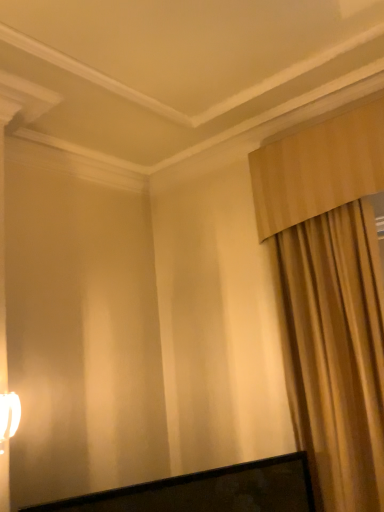
The image size is (384, 512). Describe the element at coordinates (330, 296) in the screenshot. I see `beige fabric curtain at right` at that location.

At what (x,y) coordinates should I click in order to perform the action: click on beige fabric curtain at right. Please return your answer as a coordinate pair (x, y). This screenshot has height=512, width=384. Looking at the image, I should click on (330, 296).

At what (x,y) coordinates should I click in order to perform the action: click on white glossy table lamp at left. Please return your answer as a coordinate pair (x, y). The height and width of the screenshot is (512, 384). Looking at the image, I should click on (9, 417).

Describe the element at coordinates (9, 417) in the screenshot. Image resolution: width=384 pixels, height=512 pixels. I see `white glossy table lamp at left` at that location.

Where is `beige fabric curtain at right`? The height and width of the screenshot is (512, 384). beige fabric curtain at right is located at coordinates (330, 296).

Which is more to the left, white glossy table lamp at left or beige fabric curtain at right?

white glossy table lamp at left is more to the left.

Which object is more forward, white glossy table lamp at left or beige fabric curtain at right?

white glossy table lamp at left is closer to the camera.

Which is closer to the camera, (x=19, y=400) or (x=295, y=219)?

Clearly, point (x=19, y=400) is closer to the camera than point (x=295, y=219).

From the image's perspective, would you say white glossy table lamp at left is positioned over beige fabric curtain at right?

No, from the image's perspective, white glossy table lamp at left is not above beige fabric curtain at right.

From a real-world perspective, which is physically below, white glossy table lamp at left or beige fabric curtain at right?

From a 3D spatial view, white glossy table lamp at left is below.

Is white glossy table lamp at left wider than beige fabric curtain at right?

No, white glossy table lamp at left is not wider than beige fabric curtain at right.

In terms of height, does white glossy table lamp at left look taller or shorter compared to beige fabric curtain at right?

In the image, white glossy table lamp at left appears to be shorter than beige fabric curtain at right.

Looking at this image, based on their sizes in the image, would you say white glossy table lamp at left is bigger or smaller than beige fabric curtain at right?

Clearly, white glossy table lamp at left is smaller in size than beige fabric curtain at right.

Could beige fabric curtain at right be considered to be inside white glossy table lamp at left?

No, beige fabric curtain at right is located outside of white glossy table lamp at left.

Would you consider white glossy table lamp at left to be distant from beige fabric curtain at right?

Yes, white glossy table lamp at left is far from beige fabric curtain at right.

Is white glossy table lamp at left turned away from beige fabric curtain at right?

No, beige fabric curtain at right is not at the back of white glossy table lamp at left.

How many degrees apart are the facing directions of white glossy table lamp at left and beige fabric curtain at right?

white glossy table lamp at left and beige fabric curtain at right are facing 90.3 degrees away from each other.

Identify the location of table lamp in front of the beige fabric curtain at right. This screenshot has width=384, height=512. (9, 417).

Can you confirm if beige fabric curtain at right is positioned to the left of white glossy table lamp at left?

In fact, beige fabric curtain at right is to the right of white glossy table lamp at left.

Based on the photo, which object is more forward, beige fabric curtain at right or white glossy table lamp at left?

Positioned in front is white glossy table lamp at left.

Does point (375, 441) come behind point (15, 423)?

Yes, point (375, 441) is behind point (15, 423).

From the image's perspective, does beige fabric curtain at right appear lower than white glossy table lamp at left?

Actually, beige fabric curtain at right appears above white glossy table lamp at left in the image.

From a real-world perspective, is beige fabric curtain at right positioned above or below white glossy table lamp at left?

beige fabric curtain at right is situated higher than white glossy table lamp at left in the real world.

Which object is wider, beige fabric curtain at right or white glossy table lamp at left?

beige fabric curtain at right.

Who is taller, beige fabric curtain at right or white glossy table lamp at left?

With more height is beige fabric curtain at right.

Which of these two, beige fabric curtain at right or white glossy table lamp at left, is smaller?

Smaller between the two is white glossy table lamp at left.

Is beige fabric curtain at right inside or outside of white glossy table lamp at left?

beige fabric curtain at right is located beyond the bounds of white glossy table lamp at left.

Does beige fabric curtain at right touch white glossy table lamp at left?

beige fabric curtain at right and white glossy table lamp at left are not in contact.

Is white glossy table lamp at left at the back of beige fabric curtain at right?

No, beige fabric curtain at right is not facing the opposite direction of white glossy table lamp at left.

Can you tell me how much beige fabric curtain at right and white glossy table lamp at left differ in facing direction?

There is a 90.3-degree angle between the facing directions of beige fabric curtain at right and white glossy table lamp at left.

This screenshot has width=384, height=512. I want to click on table lamp in front of the beige fabric curtain at right, so click(x=9, y=417).

The width and height of the screenshot is (384, 512). What are the coordinates of `curtain that is on the right side of white glossy table lamp at left` in the screenshot? It's located at [x=330, y=296].

Identify the location of table lamp on the left of the beige fabric curtain at right. (9, 417).